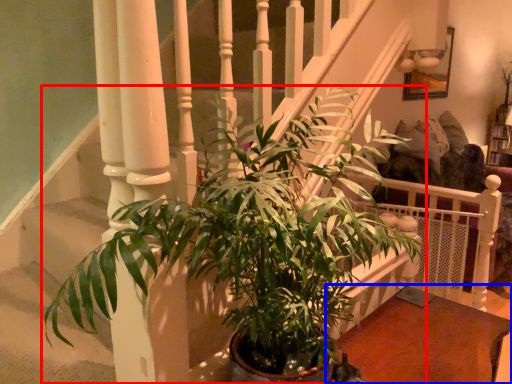
Question: Which point is closer to the camera, houseplant (highlighted by a red box) or table (highlighted by a blue box)?

Choices:
 (A) houseplant
 (B) table

Answer: (A)